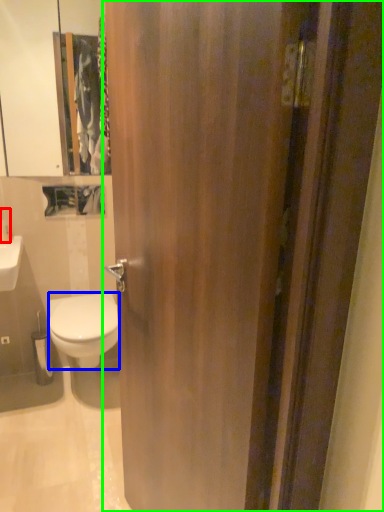
Question: Based on their relative distances, which object is nearer to toiletry (highlighted by a red box)? Choose from bidet (highlighted by a blue box) and door (highlighted by a green box).

Choices:
 (A) bidet
 (B) door

Answer: (A)